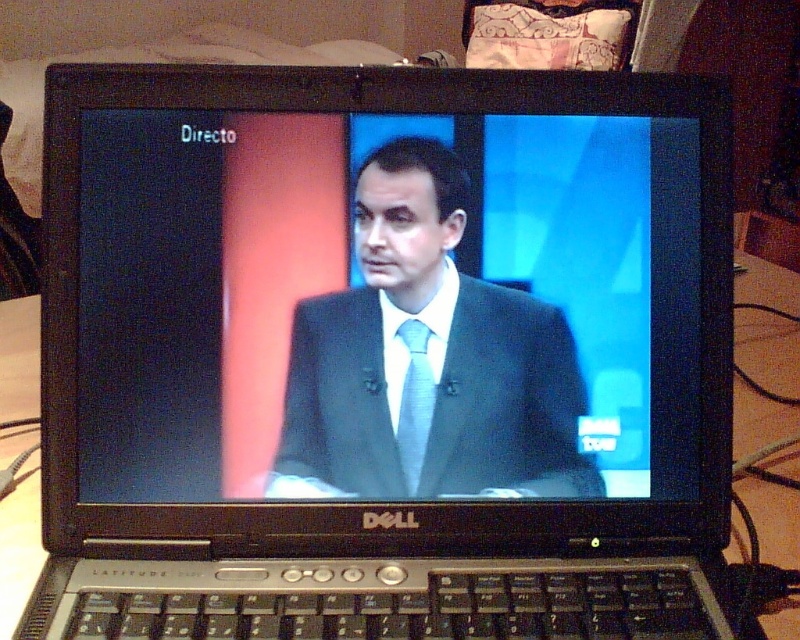
Does matte black suit at center come behind light blue silk tie at center?

Yes, it is behind light blue silk tie at center.

Who is lower down, matte black suit at center or light blue silk tie at center?

light blue silk tie at center

What do you see at coordinates (432, 397) in the screenshot?
I see `matte black suit at center` at bounding box center [432, 397].

What are the coordinates of `matte black suit at center` in the screenshot? It's located at (432, 397).